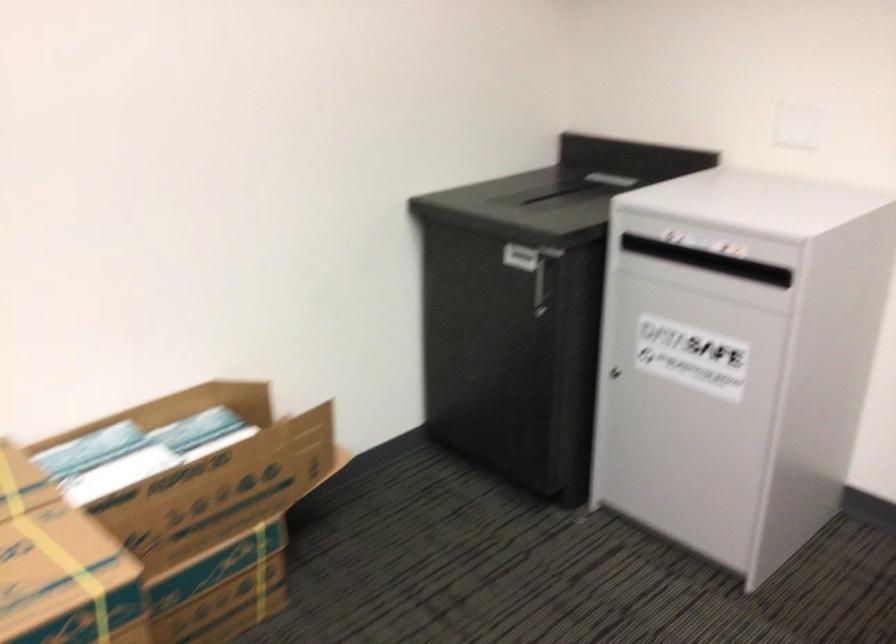
This screenshot has height=644, width=896. I want to click on stack of papers, so click(136, 451).